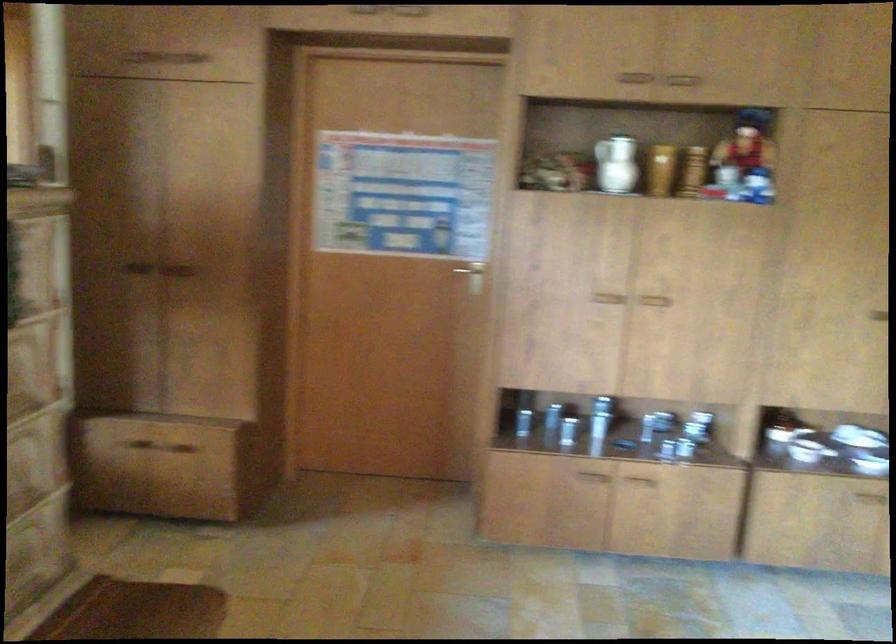
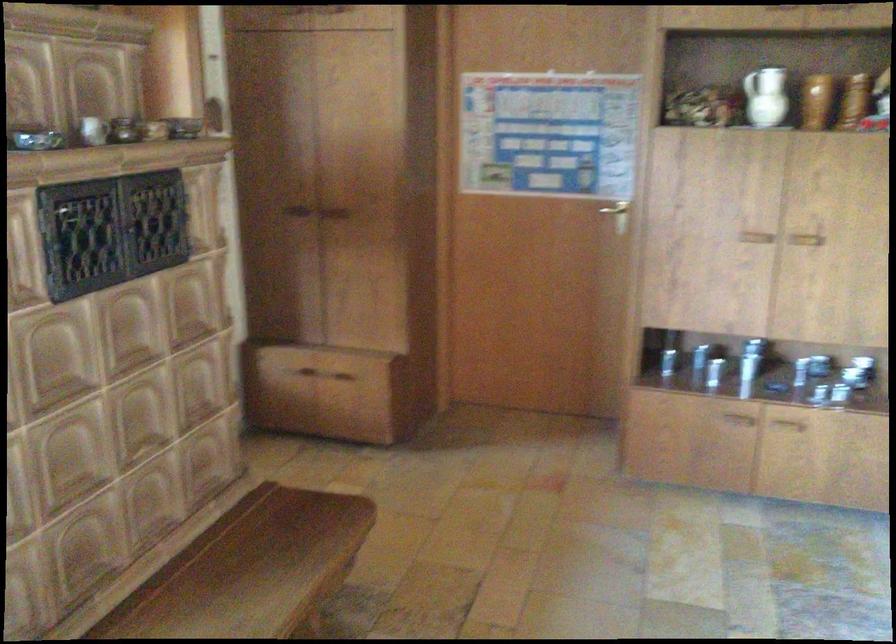
In the second image, find the point that corresponds to pixel 474 275 in the first image.

(616, 214)